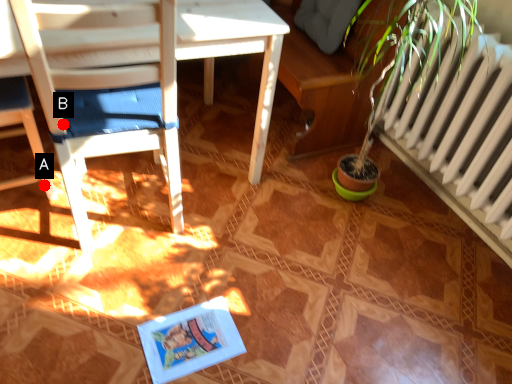
Question: Two points are circled on the image, labeled by A and B beside each circle. Which point is farther from the camera taking this photo?

Choices:
 (A) A is further
 (B) B is further

Answer: (A)